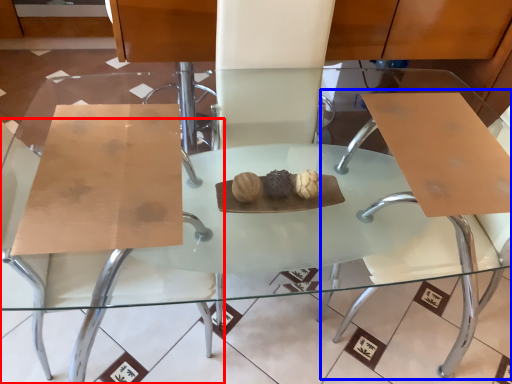
Question: Which of the following is the closest to the observer, chair (highlighted by a red box) or swivel chair (highlighted by a blue box)?

Choices:
 (A) chair
 (B) swivel chair

Answer: (A)